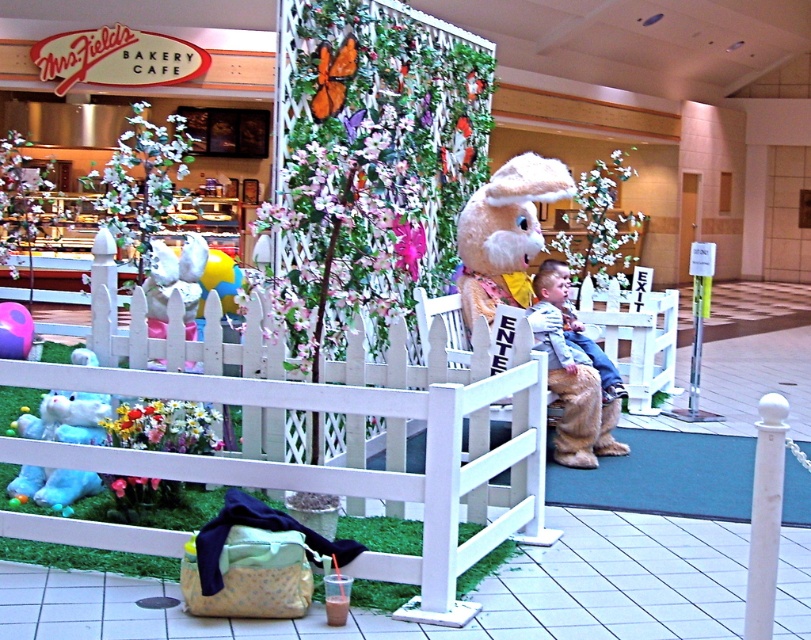
Who is lower down, fluffy beige bunny at center or light blue denim jeans at center?

light blue denim jeans at center

Between point (563, 432) and point (610, 381), which one is positioned in front?

Point (563, 432) is more forward.

Where is `fluffy beige bunny at center`? The height and width of the screenshot is (640, 811). fluffy beige bunny at center is located at coordinates (533, 296).